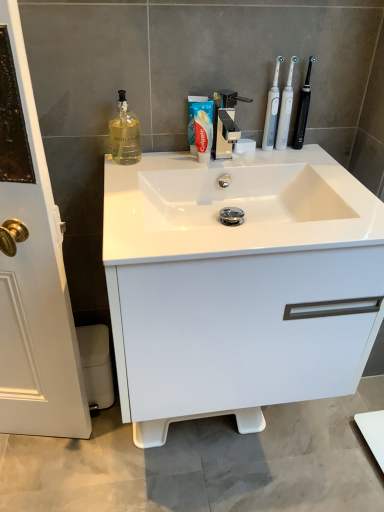
Question: Considering the relative sizes of white plastic toothbrush at upper right, the second toothbrush viewed from the right, and black plastic toothbrush at upper right, positioned as the first toothbrush in right-to-left order, in the image provided, is white plastic toothbrush at upper right, the second toothbrush viewed from the right, taller than black plastic toothbrush at upper right, positioned as the first toothbrush in right-to-left order,?

Choices:
 (A) yes
 (B) no

Answer: (A)

Question: Is white plastic toothbrush at upper right, the second toothbrush viewed from the left, looking in the opposite direction of black plastic toothbrush at upper right, the third toothbrush in the left-to-right sequence?

Choices:
 (A) no
 (B) yes

Answer: (A)

Question: Is white plastic toothbrush at upper right, the second toothbrush viewed from the left, surrounding black plastic toothbrush at upper right, positioned as the first toothbrush in right-to-left order?

Choices:
 (A) yes
 (B) no

Answer: (B)

Question: From a real-world perspective, is white plastic toothbrush at upper right, the second toothbrush viewed from the left, positioned over black plastic toothbrush at upper right, positioned as the first toothbrush in right-to-left order, based on gravity?

Choices:
 (A) yes
 (B) no

Answer: (B)

Question: Can you confirm if white plastic toothbrush at upper right, the second toothbrush viewed from the left, is positioned to the left of black plastic toothbrush at upper right, the third toothbrush in the left-to-right sequence?

Choices:
 (A) yes
 (B) no

Answer: (A)

Question: In terms of width, does white glossy cabinet at center look wider or thinner when compared to white plastic toothbrush at upper right, the second toothbrush viewed from the right?

Choices:
 (A) thin
 (B) wide

Answer: (B)

Question: Is white glossy cabinet at center inside the boundaries of white plastic toothbrush at upper right, the second toothbrush viewed from the left, or outside?

Choices:
 (A) outside
 (B) inside

Answer: (A)

Question: Considering the positions of white glossy cabinet at center and white plastic toothbrush at upper right, the second toothbrush viewed from the left, in the image, is white glossy cabinet at center bigger or smaller than white plastic toothbrush at upper right, the second toothbrush viewed from the left,?

Choices:
 (A) big
 (B) small

Answer: (A)

Question: In the image, is white glossy cabinet at center on the left side or the right side of white plastic toothbrush at upper right, the second toothbrush viewed from the right?

Choices:
 (A) right
 (B) left

Answer: (B)

Question: Considering their positions, is translucent glass bottle at upper left located in front of or behind white plastic toothbrush at upper right, the second toothbrush viewed from the left?

Choices:
 (A) front
 (B) behind

Answer: (A)

Question: Is translucent glass bottle at upper left bigger or smaller than white plastic toothbrush at upper right, the second toothbrush viewed from the left?

Choices:
 (A) big
 (B) small

Answer: (A)

Question: Is translucent glass bottle at upper left wider or thinner than white plastic toothbrush at upper right, the second toothbrush viewed from the right?

Choices:
 (A) wide
 (B) thin

Answer: (A)

Question: Visually, is translucent glass bottle at upper left positioned to the left or to the right of white plastic toothbrush at upper right, the second toothbrush viewed from the left?

Choices:
 (A) left
 (B) right

Answer: (A)

Question: Do you think white glossy sink at center is within white glossy cabinet at center, or outside of it?

Choices:
 (A) outside
 (B) inside

Answer: (B)

Question: From the image's perspective, is white glossy sink at center above or below white glossy cabinet at center?

Choices:
 (A) below
 (B) above

Answer: (B)